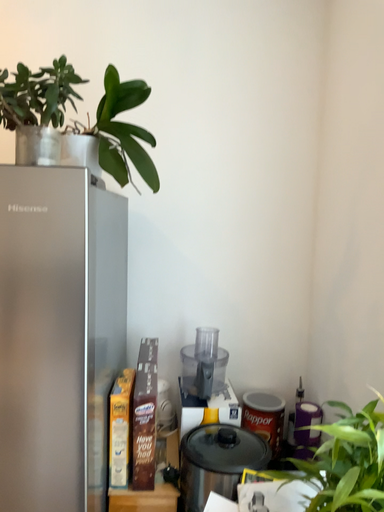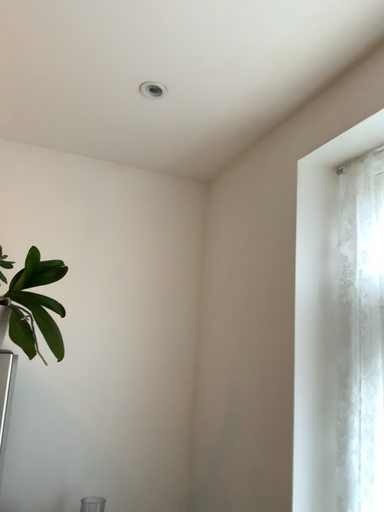
Question: How did the camera likely rotate when shooting the video?

Choices:
 (A) rotated upward
 (B) rotated downward

Answer: (A)